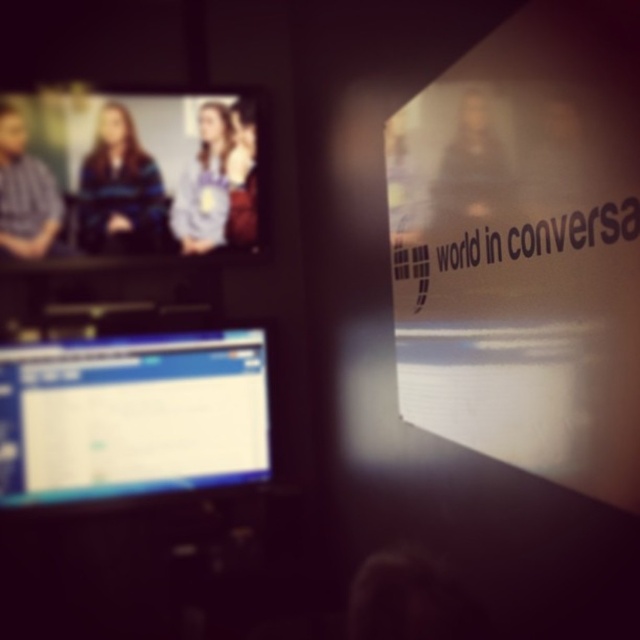
Does light blue shirt at upper center come in front of matte black shirt at upper center?

No.

Between point (211, 246) and point (445, 147), which one is positioned behind?

The point (211, 246) is more distant.

Describe the element at coordinates (209, 182) in the screenshot. I see `light blue shirt at upper center` at that location.

Where is `light blue shirt at upper center`? This screenshot has height=640, width=640. light blue shirt at upper center is located at coordinates (209, 182).

Can you confirm if striped sweater at upper left is wider than blue fabric shirt at upper left?

Correct, the width of striped sweater at upper left exceeds that of blue fabric shirt at upper left.

Can you confirm if striped sweater at upper left is taller than blue fabric shirt at upper left?

Result: No, striped sweater at upper left is not taller than blue fabric shirt at upper left.

What do you see at coordinates (120, 189) in the screenshot? I see `striped sweater at upper left` at bounding box center [120, 189].

I want to click on striped sweater at upper left, so click(x=120, y=189).

Is matte black shirt at upper center shorter than matte blue shirt at left?

Yes.

Can you confirm if matte black shirt at upper center is positioned below matte blue shirt at left?

Indeed, matte black shirt at upper center is positioned under matte blue shirt at left.

The image size is (640, 640). I want to click on matte black shirt at upper center, so click(472, 164).